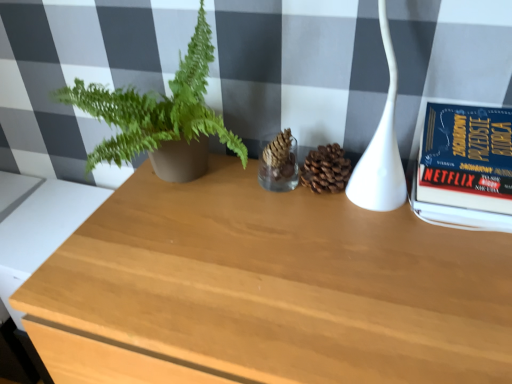
Question: Is wooden table at center, which appears as the second table when viewed from the left, closer to camera compared to light wood table at lower left, the second table when ordered from right to left?

Choices:
 (A) yes
 (B) no

Answer: (A)

Question: Is wooden table at center, which appears as the second table when viewed from the left, far from light wood table at lower left, the second table when ordered from right to left?

Choices:
 (A) yes
 (B) no

Answer: (B)

Question: Does wooden table at center, which appears as the second table when viewed from the left, have a greater width compared to light wood table at lower left, the second table when ordered from right to left?

Choices:
 (A) yes
 (B) no

Answer: (A)

Question: Considering the relative positions of wooden table at center, arranged as the 1th table when viewed from the right, and light wood table at lower left, acting as the 1th table starting from the left, in the image provided, is wooden table at center, arranged as the 1th table when viewed from the right, to the right of light wood table at lower left, acting as the 1th table starting from the left, from the viewer's perspective?

Choices:
 (A) yes
 (B) no

Answer: (A)

Question: Considering the relative sizes of wooden table at center, which appears as the second table when viewed from the left, and light wood table at lower left, acting as the 1th table starting from the left, in the image provided, is wooden table at center, which appears as the second table when viewed from the left, shorter than light wood table at lower left, acting as the 1th table starting from the left,?

Choices:
 (A) yes
 (B) no

Answer: (B)

Question: Is point (451, 205) positioned closer to the camera than point (27, 269)?

Choices:
 (A) farther
 (B) closer

Answer: (B)

Question: In terms of width, does hardcover book at right look wider or thinner when compared to light wood table at lower left, the second table when ordered from right to left?

Choices:
 (A) wide
 (B) thin

Answer: (B)

Question: Based on their positions, is hardcover book at right located to the left or right of light wood table at lower left, the second table when ordered from right to left?

Choices:
 (A) right
 (B) left

Answer: (A)

Question: Which is correct: hardcover book at right is inside light wood table at lower left, the second table when ordered from right to left, or outside of it?

Choices:
 (A) outside
 (B) inside

Answer: (A)

Question: From their relative heights in the image, would you say wooden table at center, arranged as the 1th table when viewed from the right, is taller or shorter than light wood table at lower left, the second table when ordered from right to left?

Choices:
 (A) tall
 (B) short

Answer: (A)

Question: From a real-world perspective, is wooden table at center, which appears as the second table when viewed from the left, physically located above or below light wood table at lower left, acting as the 1th table starting from the left?

Choices:
 (A) below
 (B) above

Answer: (A)

Question: In terms of size, does wooden table at center, which appears as the second table when viewed from the left, appear bigger or smaller than light wood table at lower left, the second table when ordered from right to left?

Choices:
 (A) small
 (B) big

Answer: (B)

Question: Would you say wooden table at center, arranged as the 1th table when viewed from the right, is to the left or to the right of light wood table at lower left, the second table when ordered from right to left, in the picture?

Choices:
 (A) right
 (B) left

Answer: (A)

Question: From their relative heights in the image, would you say white glossy lamp at upper right is taller or shorter than hardcover book at right?

Choices:
 (A) short
 (B) tall

Answer: (B)

Question: Is point (x=352, y=177) closer or farther from the camera than point (x=438, y=178)?

Choices:
 (A) closer
 (B) farther

Answer: (B)